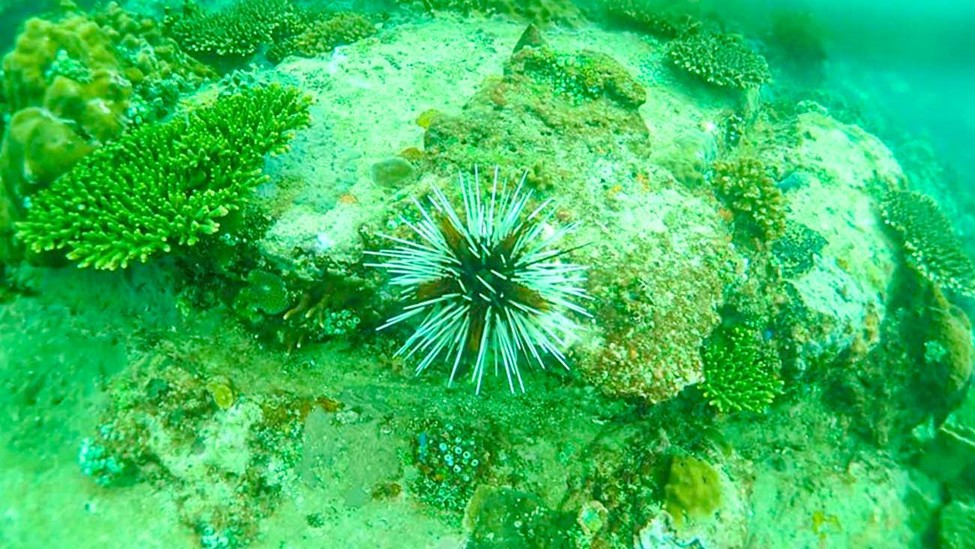
The width and height of the screenshot is (975, 549). In order to click on plant on the left side in this screenshot , I will do `click(152, 191)`.